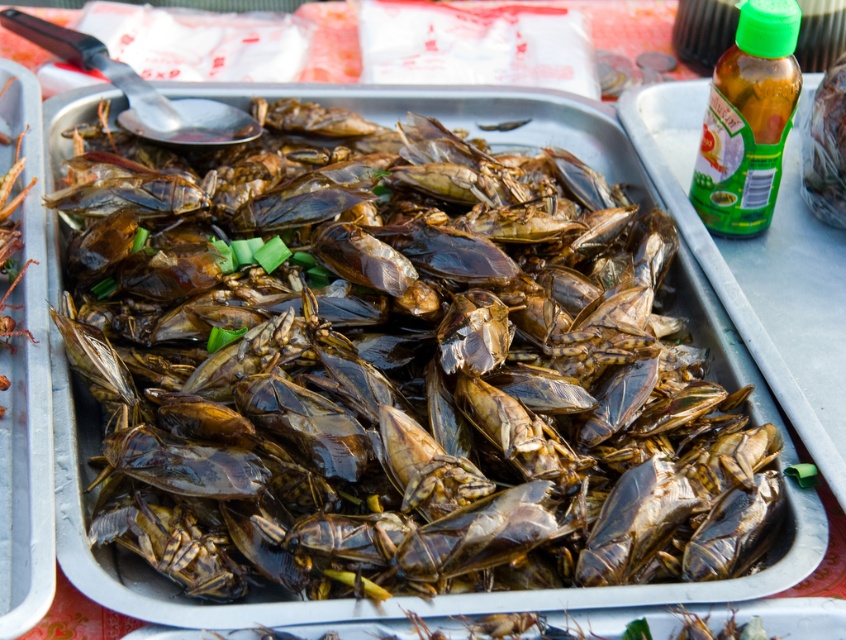
Does point (163, 483) lie behind point (699, 186)?

That is False.

The image size is (846, 640). Identify the location of shiny brown insects at center. (394, 364).

You are a GUI agent. You are given a task and a screenshot of the screen. Output one action in this format:
    pyautogui.click(x=<x>, y=<y>)
    Task: Click on the shiny brown insects at center
    The width and height of the screenshot is (846, 640).
    Given the screenshot: What is the action you would take?
    pyautogui.click(x=394, y=364)